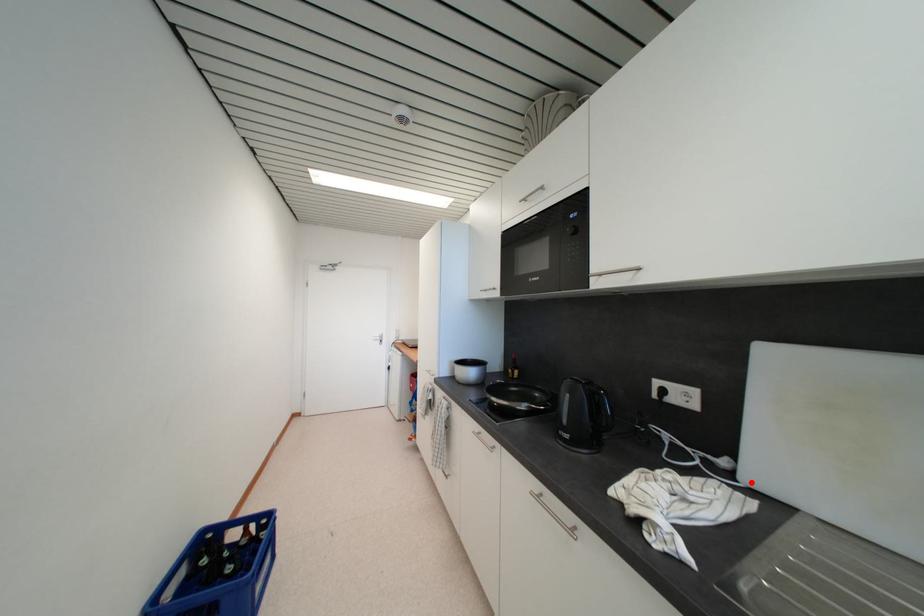
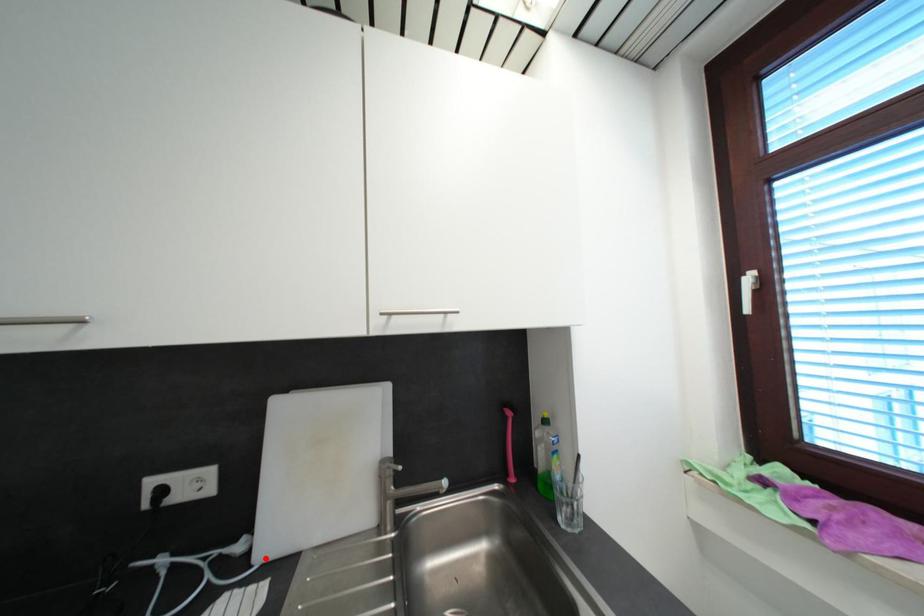
I am providing you with two images of the same scene from different viewpoints. A red point is marked on the first image and another point is marked on the second image. Is the marked point in image1 the same physical position as the marked point in image2?

Yes